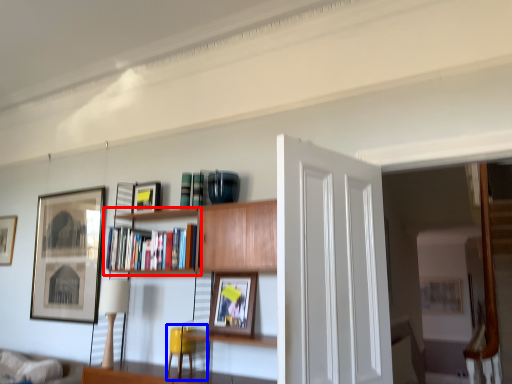
Question: Which object is closer to the camera taking this photo, shelf (highlighted by a red box) or swivel chair (highlighted by a blue box)?

Choices:
 (A) shelf
 (B) swivel chair

Answer: (A)